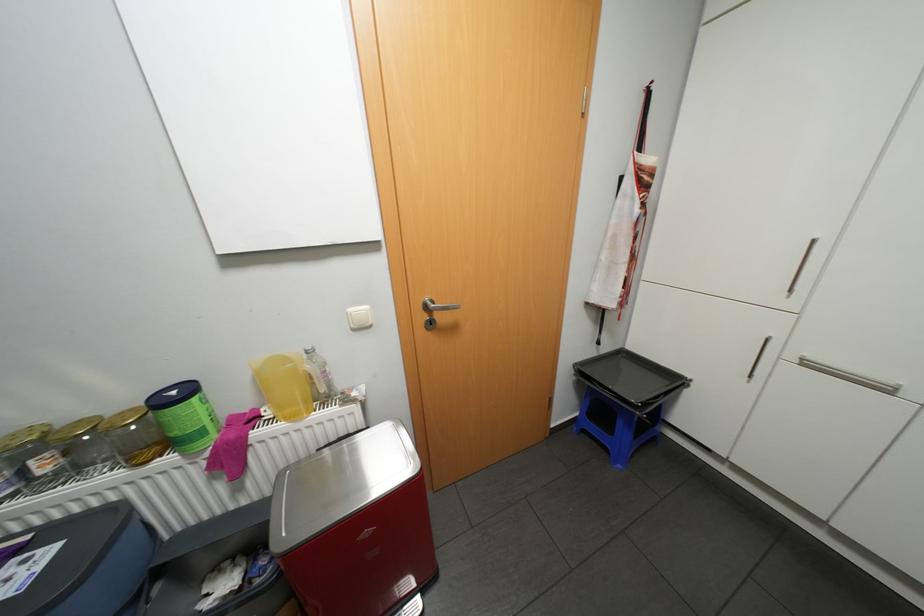
Where would you push the white light switch? Please return your answer as a coordinate pair (x, y).

(359, 317)